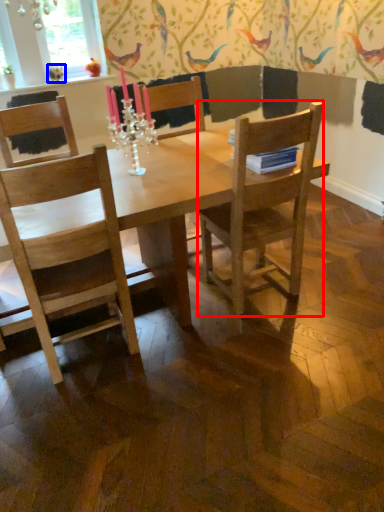
Question: Which object appears closest to the camera in this image, chair (highlighted by a red box) or bird (highlighted by a blue box)?

Choices:
 (A) chair
 (B) bird

Answer: (A)